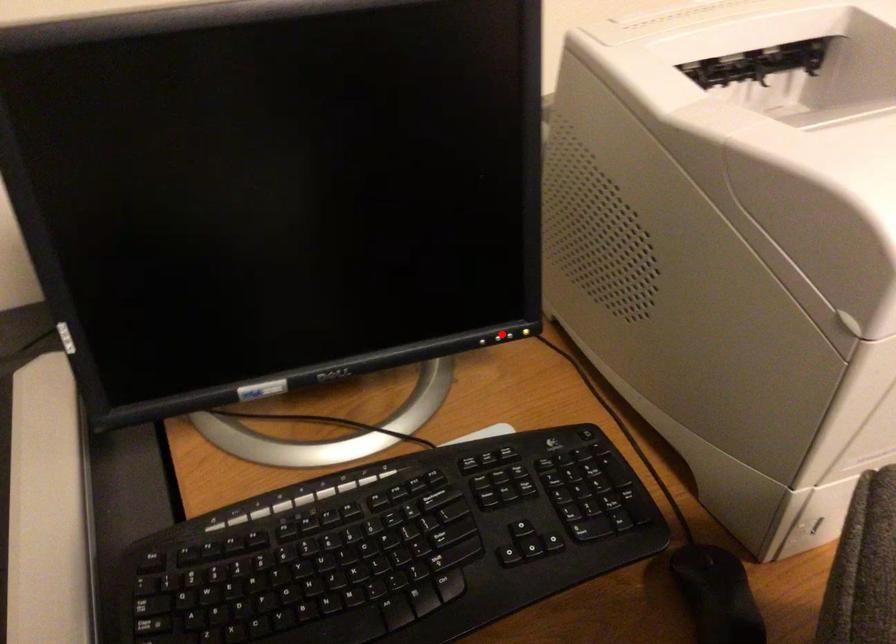
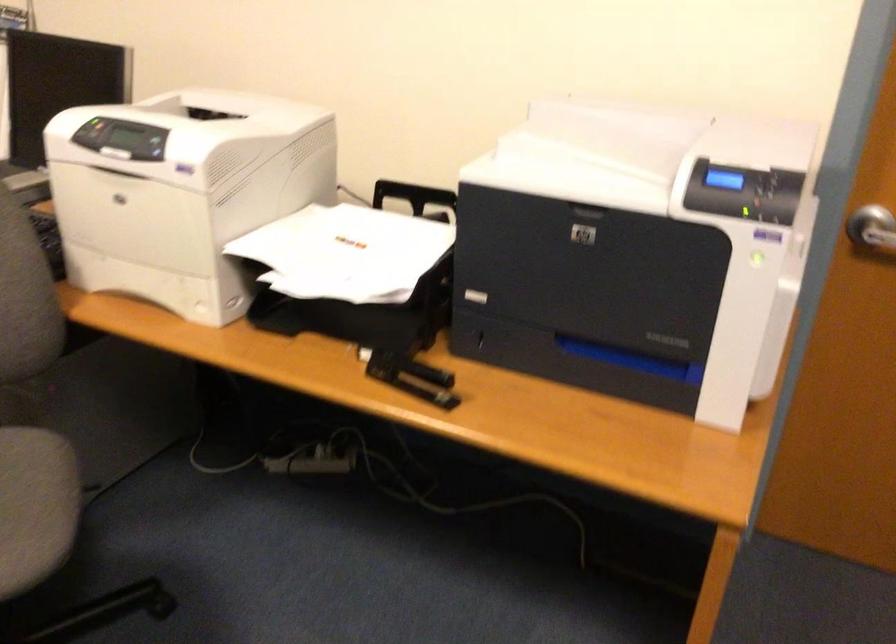
Question: I am providing you with two images of the same scene from different viewpoints. A red point is marked on the first image. Is the red point's position out of view in image 2?

Choices:
 (A) Yes
 (B) No

Answer: (A)